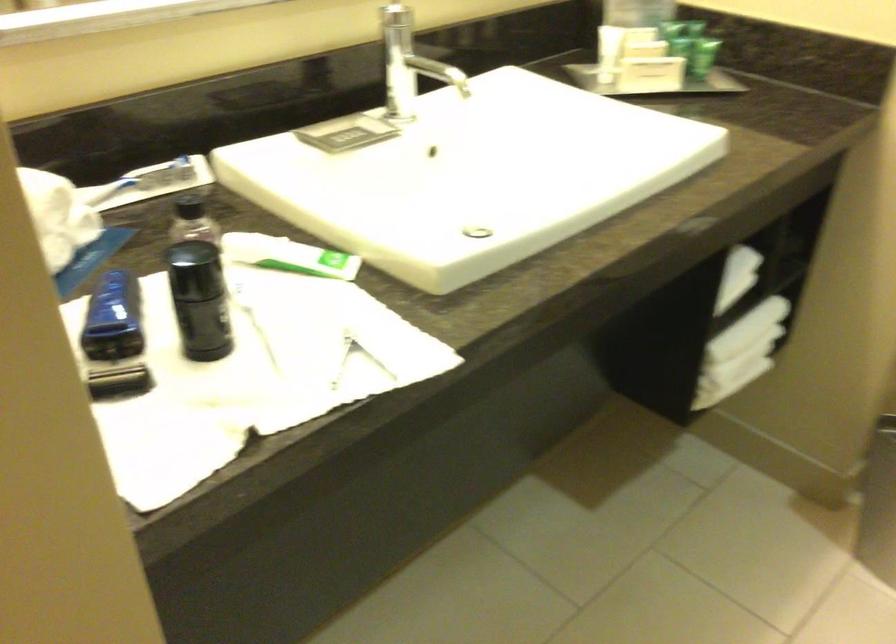
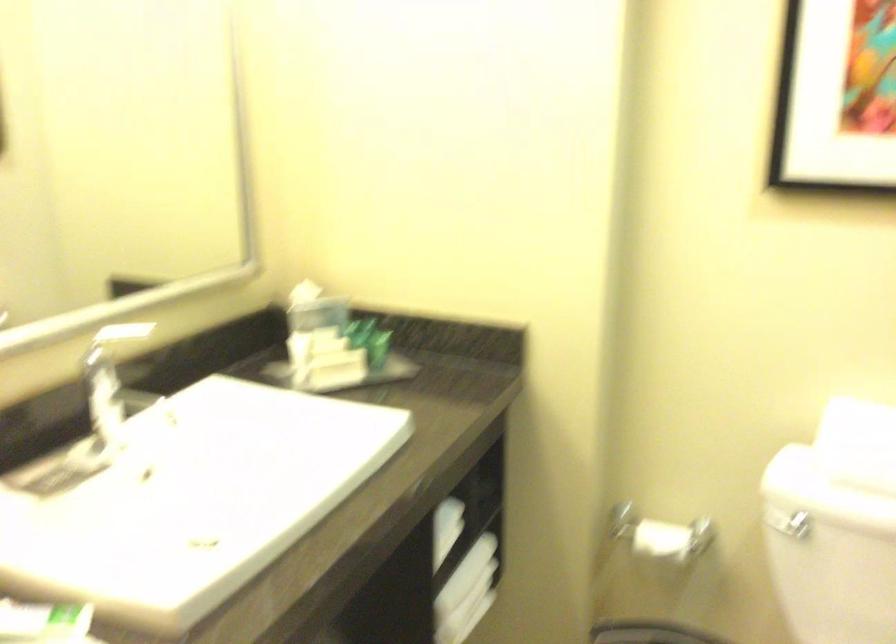
Find the pixel in the second image that matches [633,73] in the first image.

(321, 370)